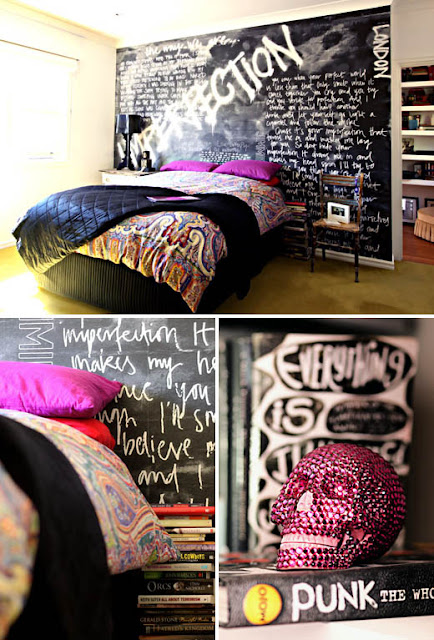
Locate an element on the screen. This screenshot has width=434, height=640. black comforter is located at coordinates (76, 212), (64, 504).